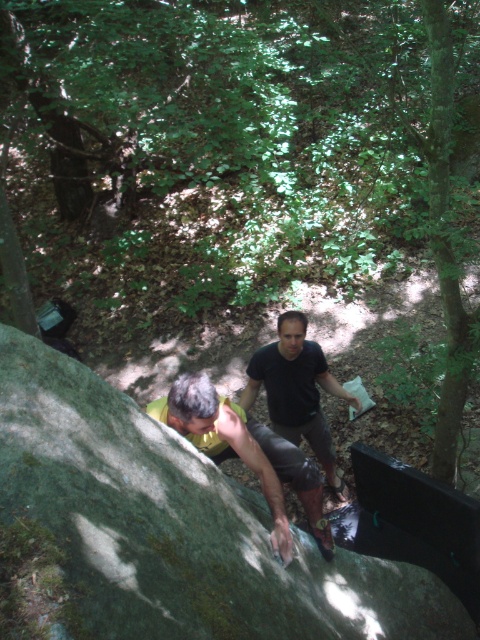
You are a rock climber preparing to ascend the rock face. You have to choose between the green mossy rock at center and the green mossy rock at lower left. Which one is closer to your current position?

The green mossy rock at lower left is closer to your current position since it is positioned lower and closer to the base of the rock face compared to the green mossy rock at center, which is higher up.

You are a hiker who wants to climb the green mossy rock at center. Based on the coordinates provided, can you determine if the rock is positioned in the center of the image?

The green mossy rock at center is located at coordinates point (179,525), which means it is positioned in the center of the image.